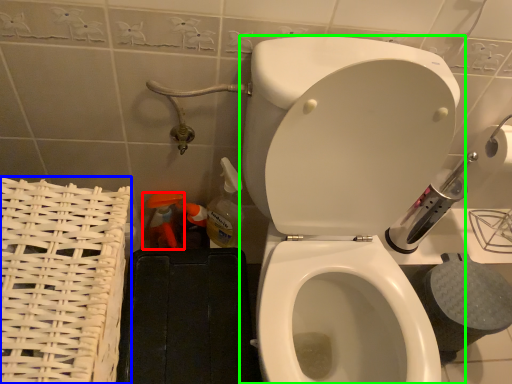
Question: Which is nearer to the cleaning product (highlighted by a red box)? basket (highlighted by a blue box) or toilet (highlighted by a green box).

Choices:
 (A) basket
 (B) toilet

Answer: (A)